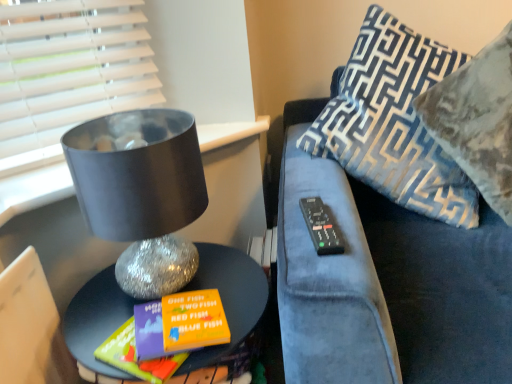
Question: Considering the positions of shiny metallic table at lower left and velvet-patterned pillow at upper right, positioned as the second pillow in left-to-right order, in the image, is shiny metallic table at lower left wider or thinner than velvet-patterned pillow at upper right, positioned as the second pillow in left-to-right order,?

Choices:
 (A) wide
 (B) thin

Answer: (B)

Question: Do you think shiny metallic table at lower left is within velvet-patterned pillow at upper right, the 1th pillow in the right-to-left sequence, or outside of it?

Choices:
 (A) outside
 (B) inside

Answer: (A)

Question: Which object is positioned farthest from the velvet blue couch at upper right?

Choices:
 (A) matte black lampshade at left
 (B) black plastic remote at right
 (C) shiny metallic table at lower left
 (D) blue patterned pillow at right, acting as the second pillow starting from the right
 (E) velvet-patterned pillow at upper right, the 1th pillow in the right-to-left sequence

Answer: (A)

Question: Estimate the real-world distances between objects in this image. Which object is closer to the black plastic remote at right?

Choices:
 (A) velvet-patterned pillow at upper right, the 1th pillow in the right-to-left sequence
 (B) blue patterned pillow at right, acting as the second pillow starting from the right
 (C) velvet blue couch at upper right
 (D) matte black lampshade at left
 (E) shiny metallic table at lower left

Answer: (C)